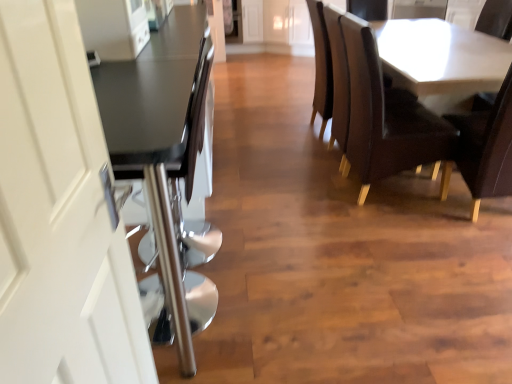
What are the coordinates of `free space in front of leather seat at right, which is the first chair in left-to-right order` in the screenshot? It's located at (398, 233).